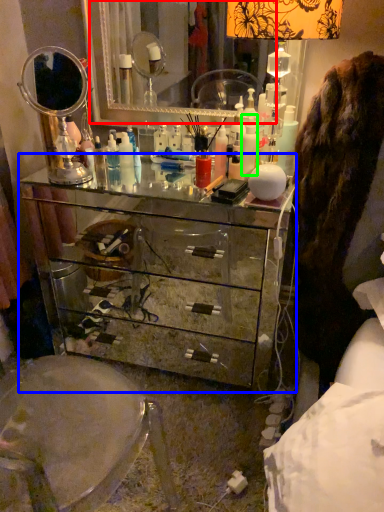
Question: Estimate the real-world distances between objects in this image. Which object is closer to mirror (highlighted by a red box), chest of drawers (highlighted by a blue box) or toiletry (highlighted by a green box)?

Choices:
 (A) chest of drawers
 (B) toiletry

Answer: (A)